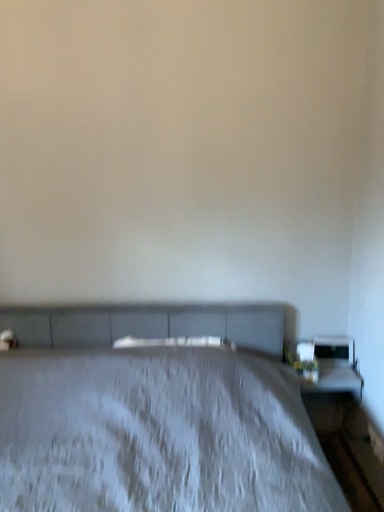
What do you see at coordinates (332, 395) in the screenshot?
I see `white glossy table at right` at bounding box center [332, 395].

At what (x,y) coordinates should I click in order to perform the action: click on white glossy table at right. Please return your answer as a coordinate pair (x, y). The width and height of the screenshot is (384, 512). Looking at the image, I should click on (332, 395).

Find the location of a particular element. The image size is (384, 512). white glossy table at right is located at coordinates (332, 395).